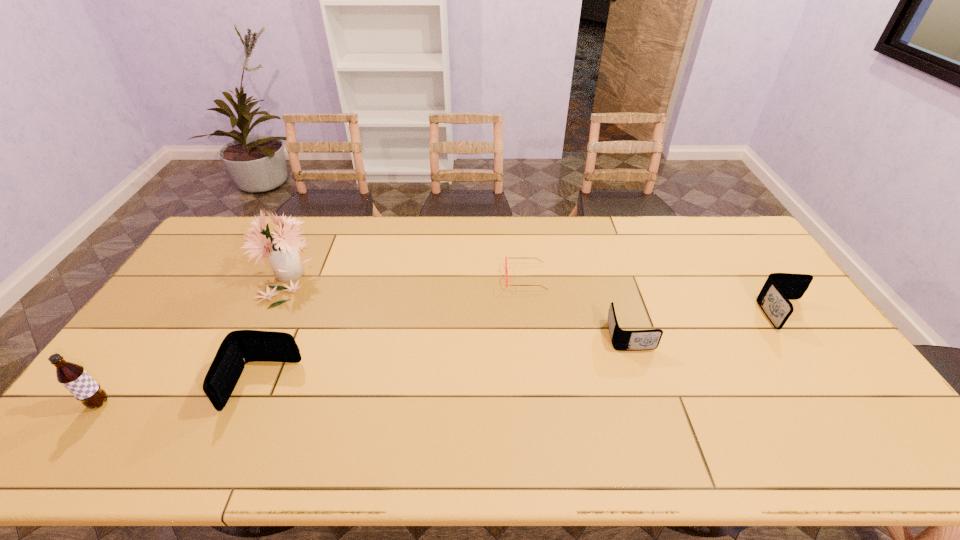
Image resolution: width=960 pixels, height=540 pixels. Identify the location of the nearest wallet. (239, 347).

You are a GUI agent. You are given a task and a screenshot of the screen. Output one action in this format:
    pyautogui.click(x=<x>, y=<y>)
    Task: Click on the second wallet from right to left
    The height and width of the screenshot is (540, 960).
    Given the screenshot: What is the action you would take?
    pyautogui.click(x=622, y=340)

Where is `the fifth object from left to right`? This screenshot has height=540, width=960. the fifth object from left to right is located at coordinates (622, 340).

The image size is (960, 540). I want to click on the rightmost object, so click(779, 288).

The image size is (960, 540). In order to click on the rightmost wallet in this screenshot , I will do `click(779, 288)`.

You are a GUI agent. You are given a task and a screenshot of the screen. Output one action in this format:
    pyautogui.click(x=<x>, y=<y>)
    Task: Click on the tallest object
    Image resolution: width=960 pixels, height=540 pixels.
    Given the screenshot: What is the action you would take?
    pyautogui.click(x=282, y=250)

The height and width of the screenshot is (540, 960). I want to click on the third object from right to left, so click(x=506, y=269).

Identify the location of spectacles. (506, 269).

Locate an element on the screen. This screenshot has width=960, height=540. the leftmost object is located at coordinates (73, 377).

Find the location of a particular element. The image size is (960, 540). the fifth shortest object is located at coordinates (73, 377).